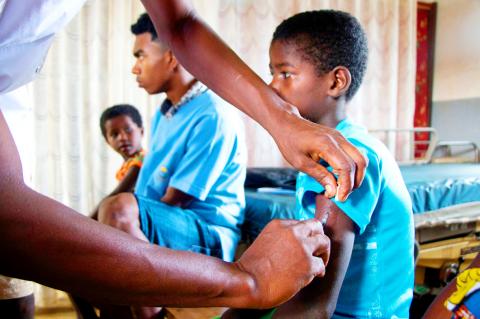
Locate an element on the screen. The image size is (480, 319). floor is located at coordinates (49, 307).